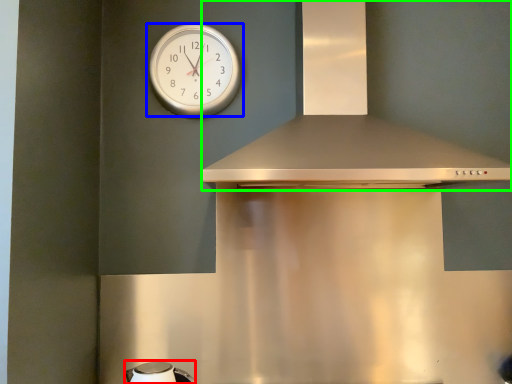
Question: Estimate the real-world distances between objects in this image. Which object is closer to appliance (highlighted by a red box), wall clock (highlighted by a blue box) or vent (highlighted by a green box)?

Choices:
 (A) wall clock
 (B) vent

Answer: (B)